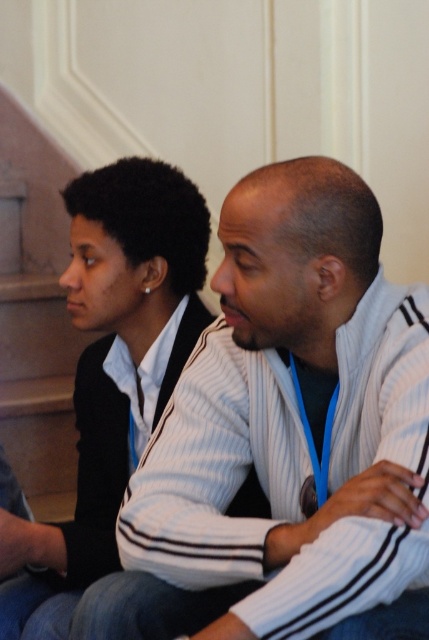
You are a photographer setting up for a group photo. You need to position two people wearing the white striped sweater at center and matte white sweater at center so that there is at least 16 inches between them. Based on their current positions, is the distance sufficient? Please explain.

The white striped sweater at center is currently 15.27 inches away from the matte white sweater at center. Since 15.27 inches is less than the required 16 inches, the distance is not sufficient. They need to move slightly further apart to meet the requirement.

Consider the image. You are a photographer setting up for a group photo. You notice two sweaters in the scene described. Which sweater, the white striped sweater at center or the matte white sweater at center, would require more space to frame properly in the photo?

The white striped sweater at center is bigger than the matte white sweater at center, so it would require more space to frame properly in the photo.